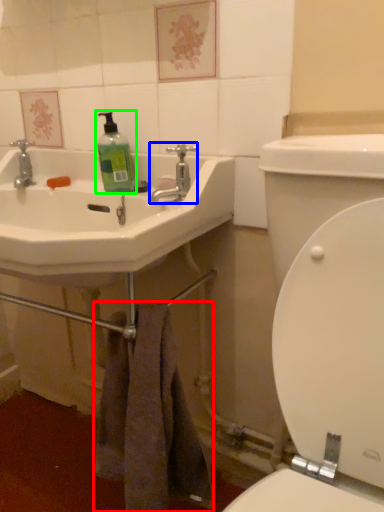
Question: Estimate the real-world distances between objects in this image. Which object is farther from towel/napkin (highlighted by a red box), tap (highlighted by a blue box) or cleaning product (highlighted by a green box)?

Choices:
 (A) tap
 (B) cleaning product

Answer: (B)